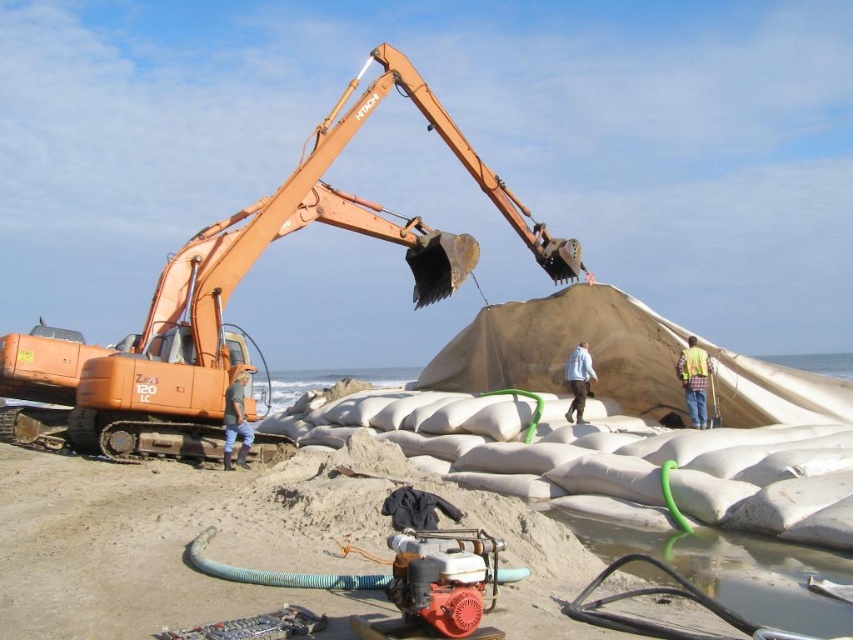
Question: Estimate the real-world distances between objects in this image. Which object is closer to the blue denim jacket at center?

Choices:
 (A) beige sandbags at center
 (B) green rubber boots at lower center
 (C) green rubber hose at lower center
 (D) yellow reflective vest at center

Answer: (D)

Question: In this image, where is yellow reflective vest at center located relative to blue denim jacket at center?

Choices:
 (A) above
 (B) below

Answer: (A)

Question: Is beige sandbags at center closer to camera compared to green rubber boots at lower center?

Choices:
 (A) yes
 (B) no

Answer: (A)

Question: Which of the following is the closest to the observer?

Choices:
 (A) (587, 346)
 (B) (184, 449)
 (C) (697, 358)

Answer: (B)

Question: Which object is the closest to the orange metallic excavator at left?

Choices:
 (A) blue denim jacket at center
 (B) yellow reflective vest at center
 (C) green rubber hose at lower center
 (D) beige sandbags at center

Answer: (D)

Question: From the image, what is the correct spatial relationship of beige sandbags at center in relation to green rubber hose at lower center?

Choices:
 (A) above
 (B) below

Answer: (A)